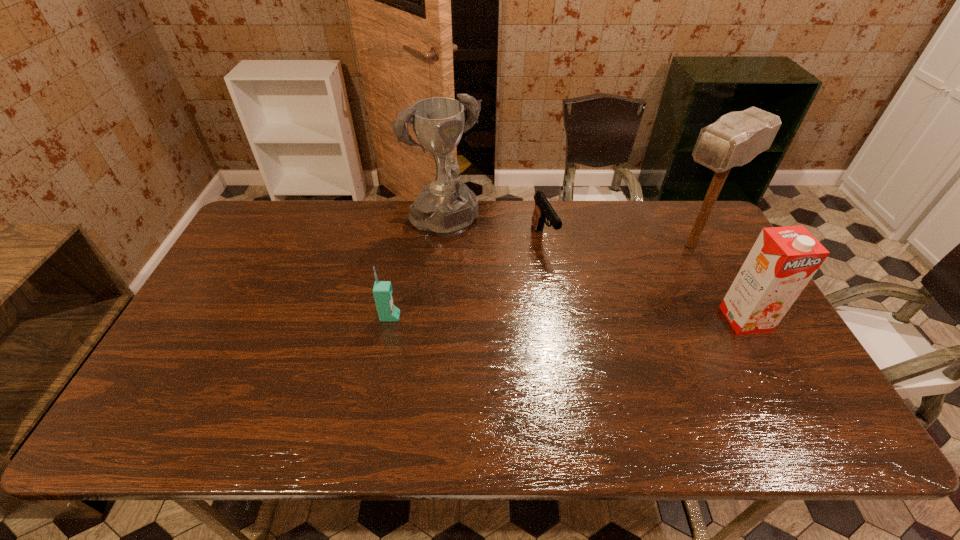
The width and height of the screenshot is (960, 540). What are the coordinates of `empty location between the award and the mallet` in the screenshot? It's located at (567, 236).

Find the location of a particular element. free space between the carton and the mallet is located at coordinates (718, 282).

At what (x,y) coordinates should I click in order to perform the action: click on free point between the mallet and the pistol. Please return your answer as a coordinate pair (x, y). The image size is (960, 540). Looking at the image, I should click on (617, 242).

The image size is (960, 540). I want to click on empty space between the pistol and the mallet, so click(x=617, y=242).

This screenshot has width=960, height=540. In order to click on empty location between the mallet and the pistol in this screenshot , I will do `click(617, 242)`.

At what (x,y) coordinates should I click in order to perform the action: click on vacant point located between the third tallest object and the shortest object. Please return your answer as a coordinate pair (x, y). Looking at the image, I should click on (644, 279).

You are a GUI agent. You are given a task and a screenshot of the screen. Output one action in this format:
    pyautogui.click(x=<x>, y=<y>)
    Task: Click on the vacant area between the third shortest object and the mallet
    
    Given the screenshot: What is the action you would take?
    pyautogui.click(x=718, y=282)

Where is `vacant space that is in between the award and the pistol`? vacant space that is in between the award and the pistol is located at coordinates [x=494, y=232].

This screenshot has height=540, width=960. Find the location of `free space between the mallet and the second shortest object`. free space between the mallet and the second shortest object is located at coordinates (540, 281).

Select which object is the third closest to the third object from right to left. Please provide its 2D coordinates. Your answer should be formatted as a tuple, i.e. [(x, y)], where the tuple contains the x and y coordinates of a point satisfying the conditions above.

[(382, 290)]